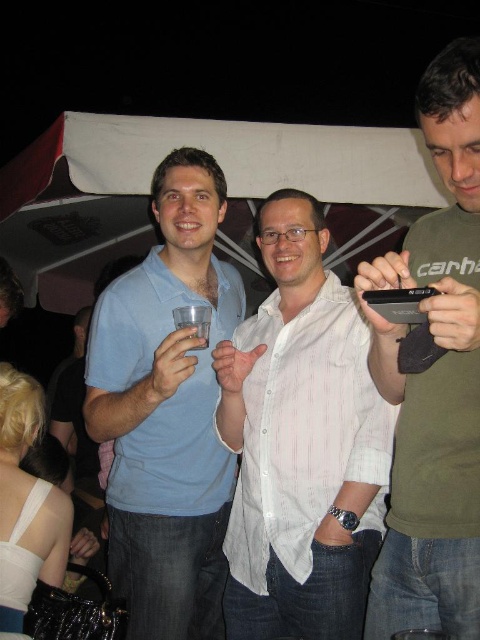
Does white striped shirt at center appear over clear plastic cup at center?

No, white striped shirt at center is not above clear plastic cup at center.

Between white striped shirt at center and clear plastic cup at center, which one appears on the right side from the viewer's perspective?

Positioned to the right is white striped shirt at center.

Looking at this image, measure the distance between point (307,220) and camera.

Point (307,220) is 1.66 meters from camera.

Where is `white striped shirt at center`? Image resolution: width=480 pixels, height=640 pixels. white striped shirt at center is located at coordinates (300, 442).

In the scene shown: Is matte blue shirt at center closer to camera compared to green matte shirt at center?

No, it is behind green matte shirt at center.

Is matte blue shirt at center to the right of green matte shirt at center from the viewer's perspective?

Incorrect, matte blue shirt at center is not on the right side of green matte shirt at center.

What do you see at coordinates (167, 412) in the screenshot? The height and width of the screenshot is (640, 480). I see `matte blue shirt at center` at bounding box center [167, 412].

This screenshot has width=480, height=640. Find the location of `matte blue shirt at center`. matte blue shirt at center is located at coordinates tap(167, 412).

Does white striped shirt at center appear under green matte shirt at center?

Indeed, white striped shirt at center is positioned under green matte shirt at center.

Consider the image. Does white striped shirt at center have a greater width compared to green matte shirt at center?

Yes, white striped shirt at center is wider than green matte shirt at center.

Is point (300, 592) closer to camera compared to point (458, 140)?

No, it is behind (458, 140).

The width and height of the screenshot is (480, 640). Identify the location of white striped shirt at center. (300, 442).